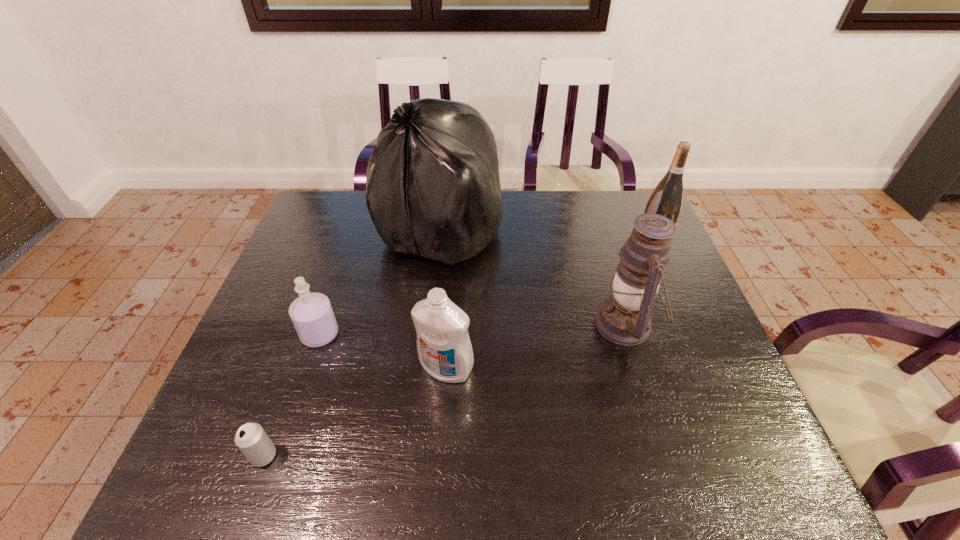
This screenshot has height=540, width=960. Find the location of `vacant space that is in between the fifth tallest object and the rightmost object`. vacant space that is in between the fifth tallest object and the rightmost object is located at coordinates (486, 289).

Locate an element on the screen. This screenshot has width=960, height=540. vacant region between the fifth tallest object and the plastic bag is located at coordinates (380, 282).

In order to click on unoccupied area between the detergent and the second object from right to left in this screenshot , I will do `click(536, 346)`.

Find the location of a particular element. Image resolution: width=960 pixels, height=540 pixels. empty location between the fourth tallest object and the second shortest object is located at coordinates coord(383,352).

Locate an element on the screen. blank region between the fifth tallest object and the oil lamp is located at coordinates (472, 329).

The width and height of the screenshot is (960, 540). In order to click on free space between the detergent and the nearest object in this screenshot , I will do `click(355, 412)`.

You are a GUI agent. You are given a task and a screenshot of the screen. Output one action in this format:
    pyautogui.click(x=<x>, y=<y>)
    Task: Click on the unoccupied area between the second object from right to left and the fifth tallest object
    Image resolution: width=960 pixels, height=540 pixels.
    Given the screenshot: What is the action you would take?
    pyautogui.click(x=472, y=329)

Select which object is the second closest to the detergent. Please provide its 2D coordinates. Your answer should be formatted as a tuple, i.e. [(x, y)], where the tuple contains the x and y coordinates of a point satisfying the conditions above.

[(434, 190)]

This screenshot has width=960, height=540. I want to click on the second closest object to the shortest object, so click(445, 352).

Image resolution: width=960 pixels, height=540 pixels. I want to click on free space that satisfies the following two spatial constraints: 1. on the back side of the second object from right to left; 2. on the left side of the fourth tallest object, so click(449, 324).